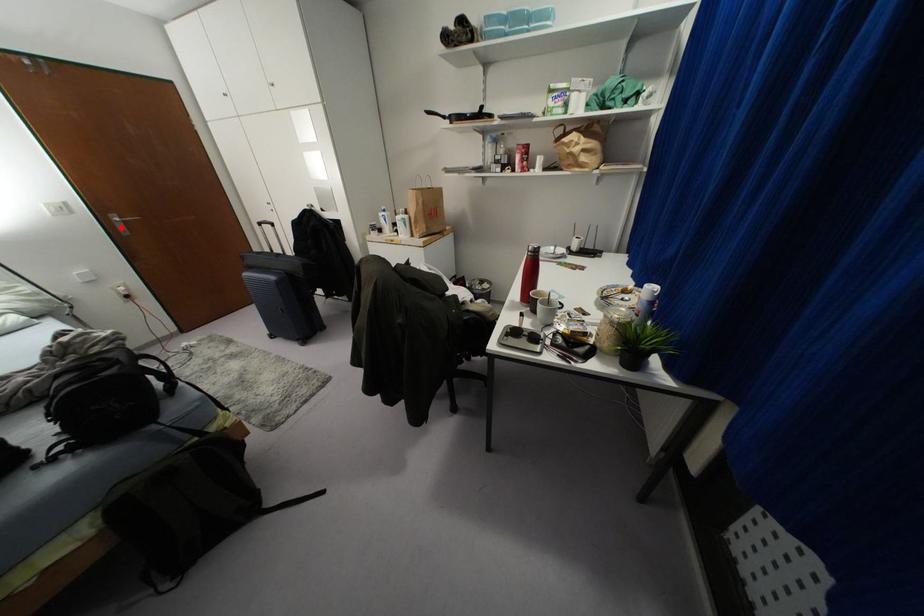
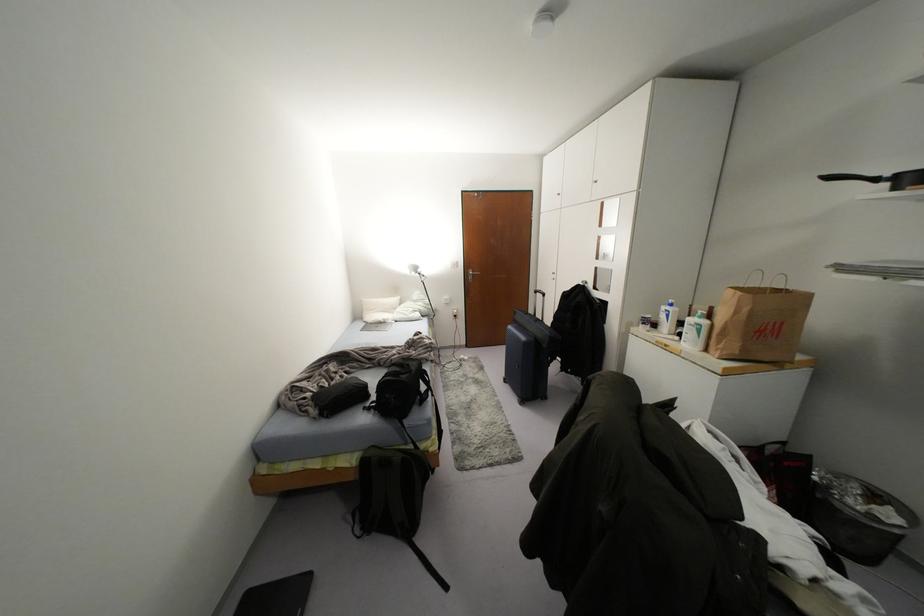
Question: I am providing you with two images of the same scene from different viewpoints. Image1 has a red point marked. In image2, the corresponding 3D location appears at what relative position? Reply with the corresponding letter.

Choices:
 (A) Closer
 (B) Farther

Answer: (A)